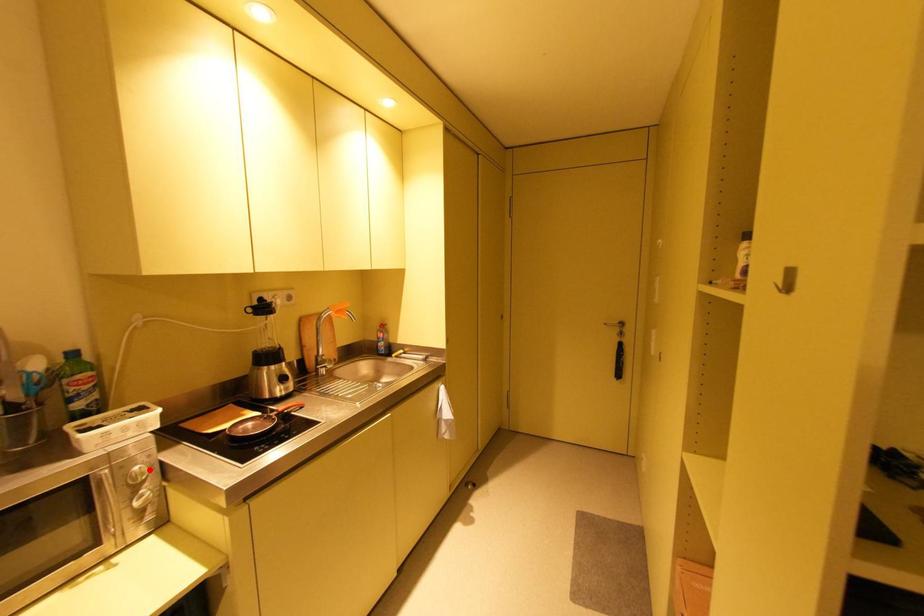
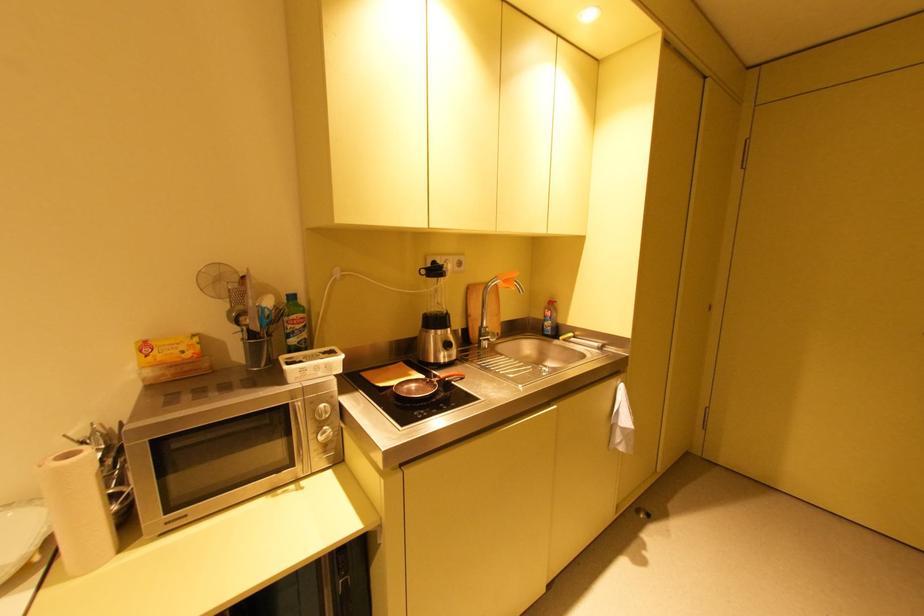
In the second image, find the point that corresponds to the highlighted location in the first image.

(333, 408)